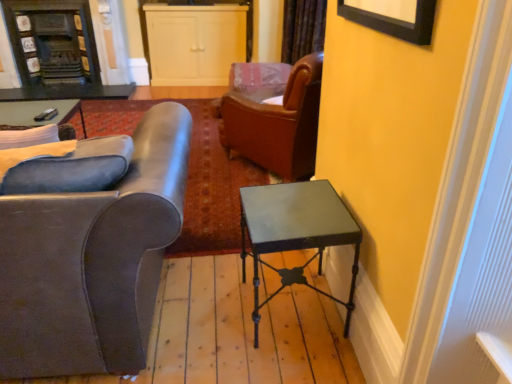
Question: Is matte gray leather armchair at left further to the viewer compared to white matte cabinet at upper center, the second cabinetry when ordered from left to right?

Choices:
 (A) no
 (B) yes

Answer: (A)

Question: Would you say matte gray leather armchair at left is a long distance from white matte cabinet at upper center, arranged as the 1th cabinetry when viewed from the right?

Choices:
 (A) yes
 (B) no

Answer: (A)

Question: Is matte gray leather armchair at left positioned beyond the bounds of white matte cabinet at upper center, the second cabinetry when ordered from left to right?

Choices:
 (A) yes
 (B) no

Answer: (A)

Question: Is matte gray leather armchair at left looking in the opposite direction of white matte cabinet at upper center, arranged as the 1th cabinetry when viewed from the right?

Choices:
 (A) yes
 (B) no

Answer: (B)

Question: Does matte gray leather armchair at left appear on the right side of white matte cabinet at upper center, arranged as the 1th cabinetry when viewed from the right?

Choices:
 (A) yes
 (B) no

Answer: (B)

Question: Is white matte cabinet at upper center, the second cabinetry when ordered from left to right, surrounded by matte gray leather armchair at left?

Choices:
 (A) no
 (B) yes

Answer: (A)

Question: From the image's perspective, is white matte cabinet at upper center, the second cabinetry when ordered from left to right, under matte black remote control at upper left?

Choices:
 (A) no
 (B) yes

Answer: (A)

Question: Can you confirm if white matte cabinet at upper center, the second cabinetry when ordered from left to right, is shorter than matte black remote control at upper left?

Choices:
 (A) no
 (B) yes

Answer: (A)

Question: Does white matte cabinet at upper center, arranged as the 1th cabinetry when viewed from the right, have a lesser width compared to matte black remote control at upper left?

Choices:
 (A) no
 (B) yes

Answer: (A)

Question: From the image's perspective, is white matte cabinet at upper center, arranged as the 1th cabinetry when viewed from the right, located above matte black remote control at upper left?

Choices:
 (A) no
 (B) yes

Answer: (B)

Question: Does white matte cabinet at upper center, the second cabinetry when ordered from left to right, have a greater width compared to matte black remote control at upper left?

Choices:
 (A) yes
 (B) no

Answer: (A)

Question: Is white matte cabinet at upper center, arranged as the 1th cabinetry when viewed from the right, far from matte black remote control at upper left?

Choices:
 (A) yes
 (B) no

Answer: (A)

Question: Would you say matte black remote control at upper left is outside matte gray leather armchair at left?

Choices:
 (A) yes
 (B) no

Answer: (A)